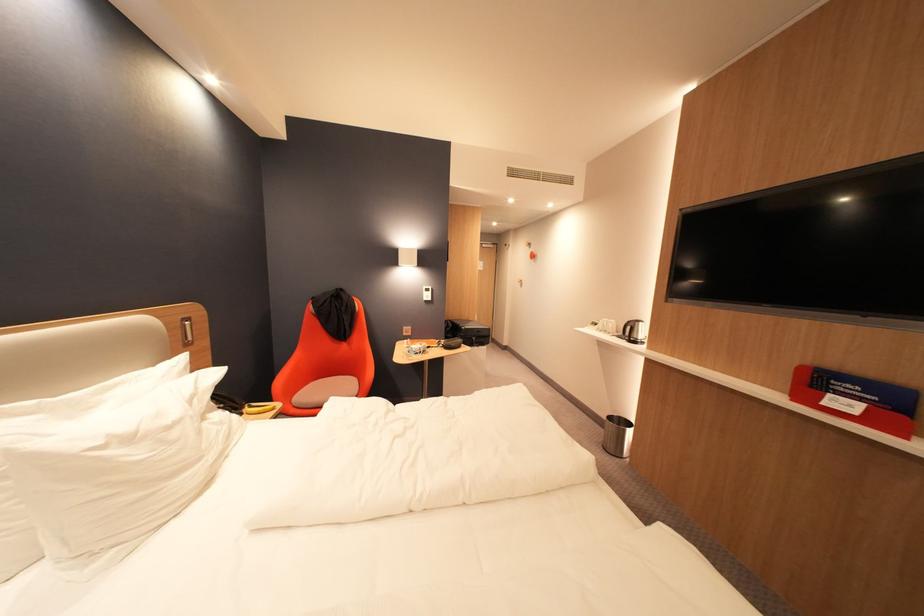
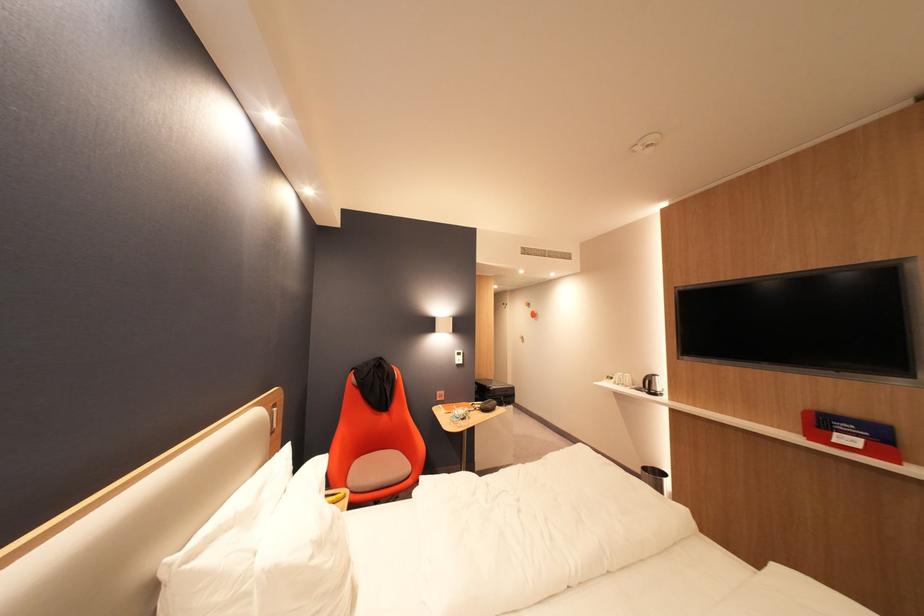
Find the pixel in the second image that matches point 472,330 in the first image.

(502, 390)